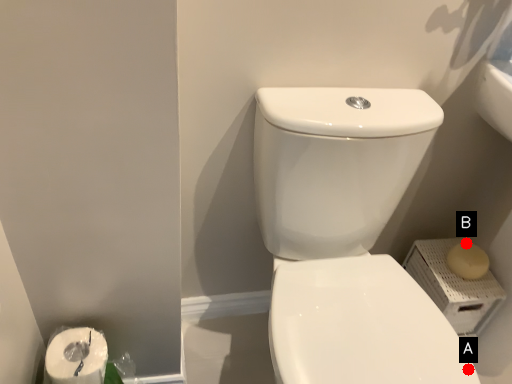
Question: Two points are circled on the image, labeled by A and B beside each circle. Which of the following is the closest to the observer?

Choices:
 (A) A is closer
 (B) B is closer

Answer: (A)